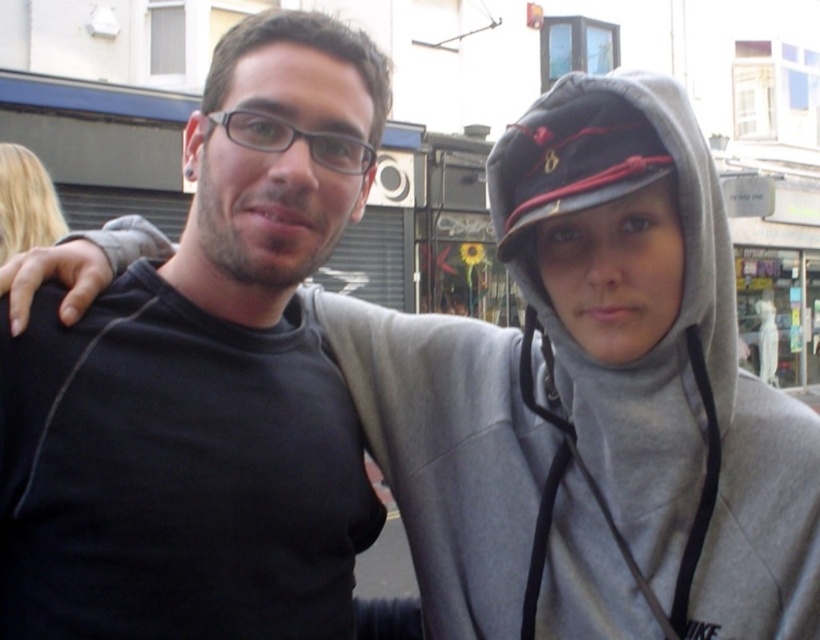
You are a photographer trying to capture both the matte black shirt at center and the gray fleece hoodie at center in a single frame. Given their sizes, which one should you focus on to ensure both are clearly visible in the photo?

The matte black shirt at center is bigger than the gray fleece hoodie at center, so focusing on the matte black shirt at center will help ensure both are clearly visible in the photo.

You are a photographer trying to capture a clear photo of both the matte black shirt at center and the gray fleece hoodie at center. However, you notice that one of them is blocking the other. Which object is being blocked and why?

The gray fleece hoodie at center is behind the matte black shirt at center, so it is being blocked by the matte black shirt at center.